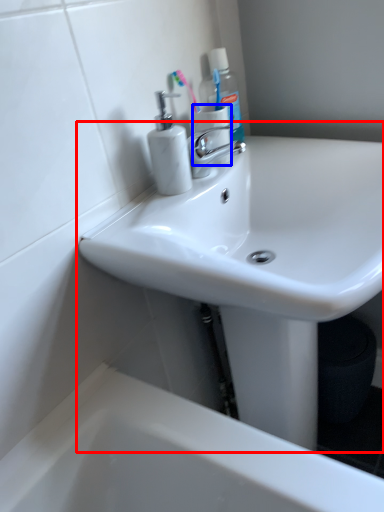
Question: Which point is closer to the camera, sink (highlighted by a red box) or toilet paper (highlighted by a blue box)?

Choices:
 (A) sink
 (B) toilet paper

Answer: (A)